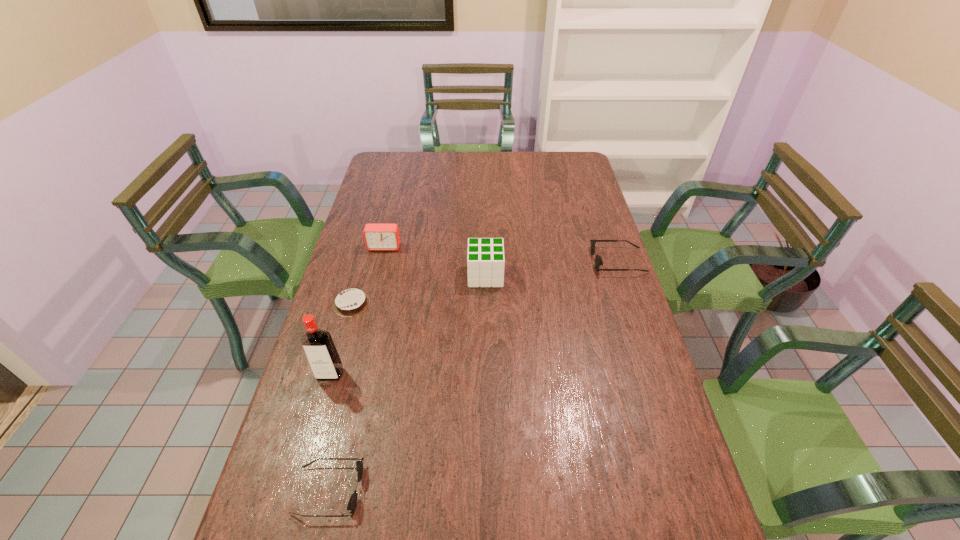
To make them evenly spaced by inserting another sunglasses among them, please locate a free space for this new sunglasses. Please provide its 2D coordinates. Your answer should be formatted as a tuple, i.e. [(x, y)], where the tuple contains the x and y coordinates of a point satisfying the conditions above.

[(505, 350)]